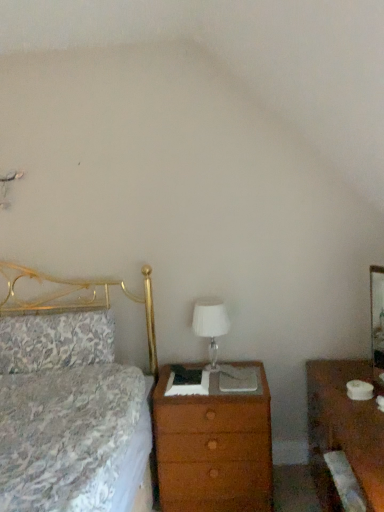
This screenshot has width=384, height=512. What do you see at coordinates (214, 448) in the screenshot?
I see `wooden chest of drawers at center` at bounding box center [214, 448].

What do you see at coordinates (210, 325) in the screenshot?
I see `white glass table lamp at center` at bounding box center [210, 325].

Measure the distance between floral fabric pillow at left and camera.

floral fabric pillow at left is 2.20 meters away from camera.

The image size is (384, 512). What are the coordinates of `wooden chest of drawers at center` in the screenshot? It's located at (214, 448).

Considering the relative sizes of floral fabric pillow at left and white glass table lamp at center in the image provided, is floral fabric pillow at left wider than white glass table lamp at center?

Yes, floral fabric pillow at left is wider than white glass table lamp at center.

Considering the positions of objects floral fabric pillow at left and white glass table lamp at center in the image provided, who is more to the left, floral fabric pillow at left or white glass table lamp at center?

Positioned to the left is floral fabric pillow at left.

Considering the points (27, 333) and (226, 333), which point is in front, point (27, 333) or point (226, 333)?

The point (27, 333) is more forward.

Based on the photo, is white glass table lamp at center at the back of floral fabric pillow at left?

No.

Looking at this image, could you tell me if floral fabric pillow at left is facing wooden chest of drawers at center?

No, floral fabric pillow at left is not oriented towards wooden chest of drawers at center.

Does point (109, 338) appear closer or farther from the camera than point (236, 453)?

Point (109, 338).

Is floral fabric pillow at left shorter than wooden chest of drawers at center?

Yes, floral fabric pillow at left is shorter than wooden chest of drawers at center.

Considering their positions, is floral fabric pillow at left located in front of or behind wooden chest of drawers at center?

Visually, floral fabric pillow at left is located behind wooden chest of drawers at center.

Are white glass table lamp at center and floral fabric pillow at left making contact?

white glass table lamp at center and floral fabric pillow at left are not in contact.

From the image's perspective, which object appears higher, white glass table lamp at center or floral fabric pillow at left?

From the image's view, white glass table lamp at center is above.

Locate an element on the screen. table lamp in front of the floral fabric pillow at left is located at coordinates (210, 325).

Considering the relative sizes of white glass table lamp at center and floral fabric pillow at left in the image provided, is white glass table lamp at center bigger than floral fabric pillow at left?

Incorrect, white glass table lamp at center is not larger than floral fabric pillow at left.

Which of these two, white glass table lamp at center or brown wood nightstand at right, stands shorter?

white glass table lamp at center is shorter.

Would you say white glass table lamp at center is to the left or to the right of brown wood nightstand at right in the picture?

From the image, it's evident that white glass table lamp at center is to the left of brown wood nightstand at right.

Between white glass table lamp at center and brown wood nightstand at right, which one has larger size?

brown wood nightstand at right is bigger.

Does point (209, 344) appear closer or farther from the camera than point (315, 463)?

Point (209, 344) is positioned farther from the camera compared to point (315, 463).

Considering the relative sizes of wooden chest of drawers at center and white glass table lamp at center in the image provided, is wooden chest of drawers at center thinner than white glass table lamp at center?

No, wooden chest of drawers at center is not thinner than white glass table lamp at center.

Between wooden chest of drawers at center and white glass table lamp at center, which one has less height?

With less height is white glass table lamp at center.

Is wooden chest of drawers at center turned away from white glass table lamp at center?

No, wooden chest of drawers at center is not facing away from white glass table lamp at center.

Is wooden chest of drawers at center far away from white glass table lamp at center?

No, wooden chest of drawers at center is in close proximity to white glass table lamp at center.

Is brown wood nightstand at right not inside floral fabric pillow at left?

Indeed, brown wood nightstand at right is completely outside floral fabric pillow at left.

Considering the points (359, 416) and (91, 311), which point is behind, point (359, 416) or point (91, 311)?

The point (91, 311) is more distant.

Is brown wood nightstand at right far from floral fabric pillow at left?

Yes, brown wood nightstand at right and floral fabric pillow at left are located far from each other.

At what (x,y) coordinates should I click in order to perform the action: click on pillow that is above the brown wood nightstand at right (from the image's perspective). Please return your answer as a coordinate pair (x, y). Image resolution: width=384 pixels, height=512 pixels. Looking at the image, I should click on (56, 340).

Does brown wood nightstand at right appear on the right side of wooden chest of drawers at center?

Correct, you'll find brown wood nightstand at right to the right of wooden chest of drawers at center.

Looking at this image, from the image's perspective, is brown wood nightstand at right beneath wooden chest of drawers at center?

Actually, brown wood nightstand at right appears above wooden chest of drawers at center in the image.

Which is in front, brown wood nightstand at right or wooden chest of drawers at center?

Positioned in front is brown wood nightstand at right.

From the picture: Is brown wood nightstand at right next to wooden chest of drawers at center?

No, brown wood nightstand at right is not with wooden chest of drawers at center.

At what (x,y) coordinates should I click in order to perform the action: click on table lamp lying on the right of floral fabric pillow at left. Please return your answer as a coordinate pair (x, y). Looking at the image, I should click on (210, 325).

Where is `the chest of drawers located below the floral fabric pillow at left (from the image's perspective)`? Image resolution: width=384 pixels, height=512 pixels. the chest of drawers located below the floral fabric pillow at left (from the image's perspective) is located at coordinates (214, 448).

Based on their spatial positions, is brown wood nightstand at right or floral fabric pillow at left closer to white glass table lamp at center?

The object closer to white glass table lamp at center is brown wood nightstand at right.

When comparing their distances from white glass table lamp at center, does floral fabric pillow at left or brown wood nightstand at right seem further?

floral fabric pillow at left is further to white glass table lamp at center.

Estimate the real-world distances between objects in this image. Which object is further from wooden chest of drawers at center, floral fabric pillow at left or brown wood nightstand at right?

floral fabric pillow at left is further to wooden chest of drawers at center.

When comparing their distances from brown wood nightstand at right, does floral fabric pillow at left or white glass table lamp at center seem further?

floral fabric pillow at left lies further to brown wood nightstand at right than the other object.

From the image, which object appears to be nearer to floral fabric pillow at left, wooden chest of drawers at center or brown wood nightstand at right?

Among the two, wooden chest of drawers at center is located nearer to floral fabric pillow at left.

When comparing their distances from brown wood nightstand at right, does white glass table lamp at center or wooden chest of drawers at center seem closer?

Based on the image, wooden chest of drawers at center appears to be nearer to brown wood nightstand at right.

From the image, which object appears to be nearer to floral fabric pillow at left, brown wood nightstand at right or white glass table lamp at center?

white glass table lamp at center.

From the image, which object appears to be nearer to wooden chest of drawers at center, brown wood nightstand at right or white glass table lamp at center?

white glass table lamp at center.

You are a GUI agent. You are given a task and a screenshot of the screen. Output one action in this format:
    pyautogui.click(x=<x>, y=<y>)
    Task: Click on the table lamp located between floral fabric pillow at left and wooden chest of drawers at center in the left-right direction
    
    Given the screenshot: What is the action you would take?
    pyautogui.click(x=210, y=325)

Locate an element on the screen. the chest of drawers situated between floral fabric pillow at left and brown wood nightstand at right from left to right is located at coordinates (214, 448).

Locate an element on the screen. The width and height of the screenshot is (384, 512). chest of drawers between white glass table lamp at center and brown wood nightstand at right from left to right is located at coordinates (214, 448).

Identify the location of table lamp between floral fabric pillow at left and brown wood nightstand at right in the horizontal direction. (210, 325).